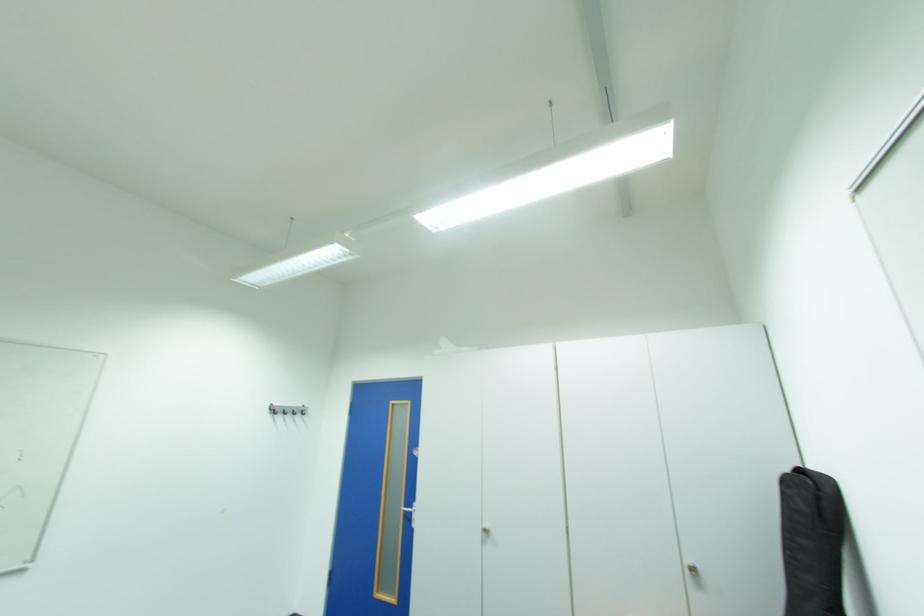
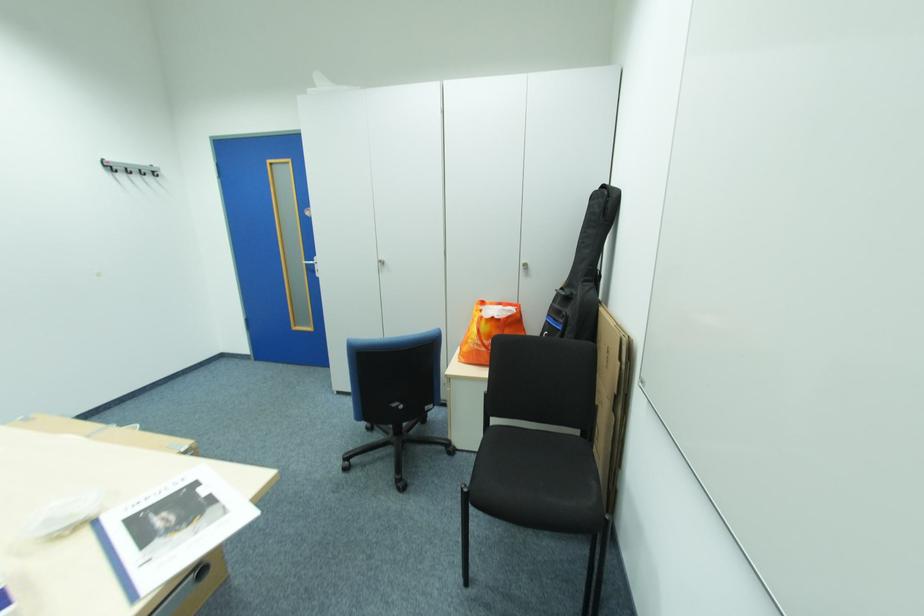
Locate, in the second image, the point that corresponds to the point at 414,511 in the first image.

(314, 265)